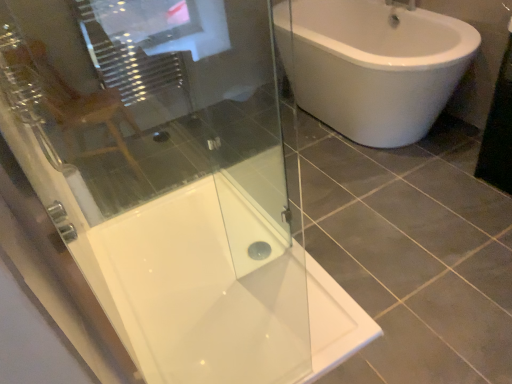
Question: Is transparent glass shower door at upper left facing towards white glossy shower tray at center?

Choices:
 (A) yes
 (B) no

Answer: (A)

Question: Is transparent glass shower door at upper left at the right side of white glossy shower tray at center?

Choices:
 (A) yes
 (B) no

Answer: (A)

Question: From a real-world perspective, is transparent glass shower door at upper left positioned over white glossy shower tray at center based on gravity?

Choices:
 (A) no
 (B) yes

Answer: (B)

Question: Can you confirm if transparent glass shower door at upper left is shorter than white glossy shower tray at center?

Choices:
 (A) yes
 (B) no

Answer: (B)

Question: Can you confirm if transparent glass shower door at upper left is thinner than white glossy shower tray at center?

Choices:
 (A) yes
 (B) no

Answer: (A)

Question: Considering the positions of white glossy shower tray at center and transparent glass shower door at upper left in the image, is white glossy shower tray at center wider or thinner than transparent glass shower door at upper left?

Choices:
 (A) thin
 (B) wide

Answer: (B)

Question: From the image's perspective, is white glossy shower tray at center above or below transparent glass shower door at upper left?

Choices:
 (A) below
 (B) above

Answer: (A)

Question: Do you think white glossy shower tray at center is within transparent glass shower door at upper left, or outside of it?

Choices:
 (A) inside
 (B) outside

Answer: (B)

Question: Considering their positions, is white glossy shower tray at center located in front of or behind transparent glass shower door at upper left?

Choices:
 (A) behind
 (B) front

Answer: (A)

Question: Considering their positions, is transparent glass shower door at upper left located in front of or behind white glossy shower tray at center?

Choices:
 (A) front
 (B) behind

Answer: (A)

Question: In the image, is transparent glass shower door at upper left on the left side or the right side of white glossy shower tray at center?

Choices:
 (A) right
 (B) left

Answer: (A)

Question: Considering the positions of transparent glass shower door at upper left and white glossy shower tray at center in the image, is transparent glass shower door at upper left bigger or smaller than white glossy shower tray at center?

Choices:
 (A) small
 (B) big

Answer: (A)

Question: From a real-world perspective, relative to white glossy shower tray at center, is transparent glass shower door at upper left vertically above or below?

Choices:
 (A) below
 (B) above

Answer: (B)

Question: From a real-world perspective, is matte wooden chair at upper left above or below transparent glass shower door at upper left?

Choices:
 (A) below
 (B) above

Answer: (A)

Question: Based on their sizes in the image, would you say matte wooden chair at upper left is bigger or smaller than transparent glass shower door at upper left?

Choices:
 (A) big
 (B) small

Answer: (A)